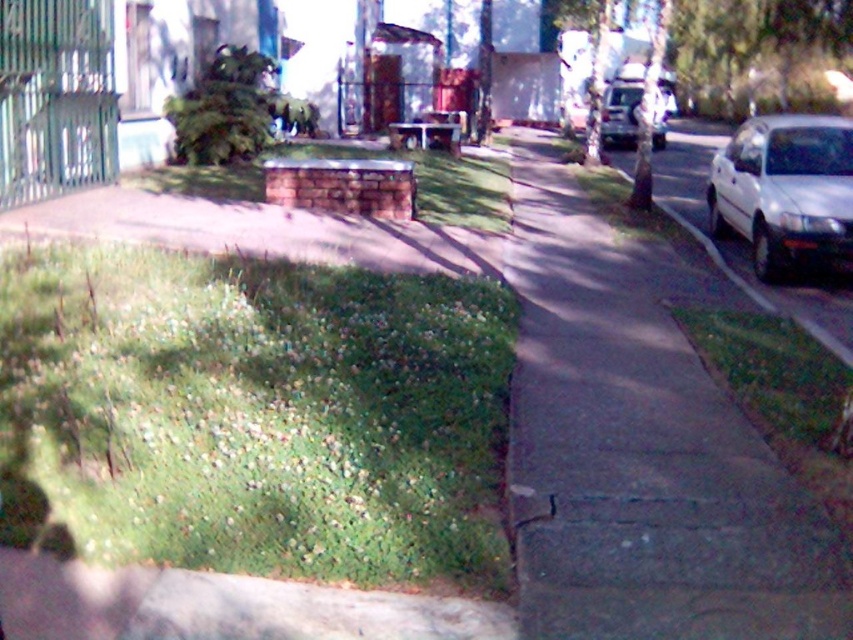
Question: Is green grass at lower right bigger than silver metallic van at center?

Choices:
 (A) yes
 (B) no

Answer: (B)

Question: Observing the image, what is the correct spatial positioning of green leafy grass at lower left in reference to silver metallic van at center?

Choices:
 (A) right
 (B) left

Answer: (B)

Question: Estimate the real-world distances between objects in this image. Which object is closer to the green leafy tree at upper center?

Choices:
 (A) white matte car at right
 (B) green grass at lower right

Answer: (A)

Question: Can you confirm if green leafy grass at lower left is positioned to the left of silver metallic van at center?

Choices:
 (A) yes
 (B) no

Answer: (A)

Question: Which point appears farthest from the camera in this image?

Choices:
 (A) (285, 97)
 (B) (631, 100)

Answer: (B)

Question: Which object appears closest to the camera in this image?

Choices:
 (A) green leafy tree at upper center
 (B) gray concrete sidewalk at center

Answer: (B)